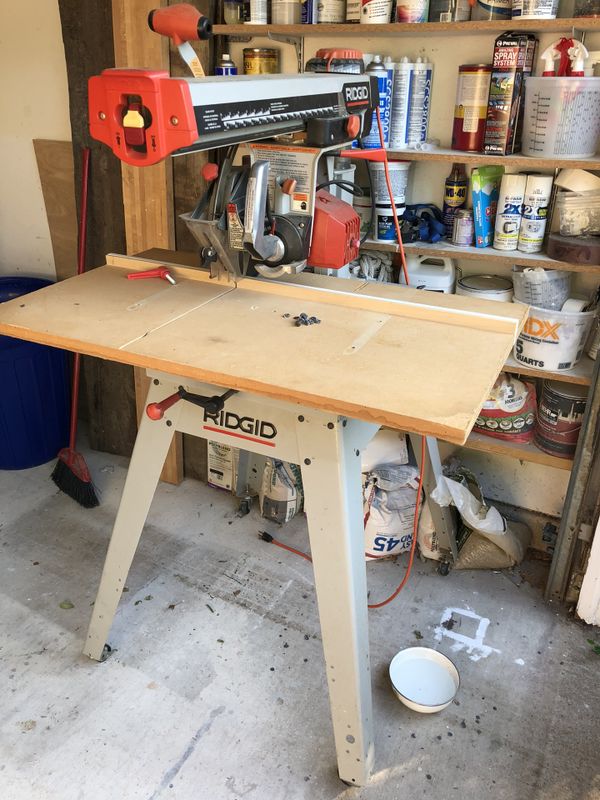
Where is `broom`? broom is located at coordinates (72, 418).